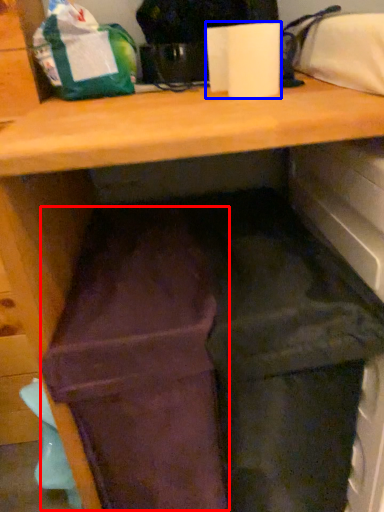
Question: Which object appears closest to the camera in this image, wide (highlighted by a red box) or paper towel (highlighted by a blue box)?

Choices:
 (A) wide
 (B) paper towel

Answer: (A)